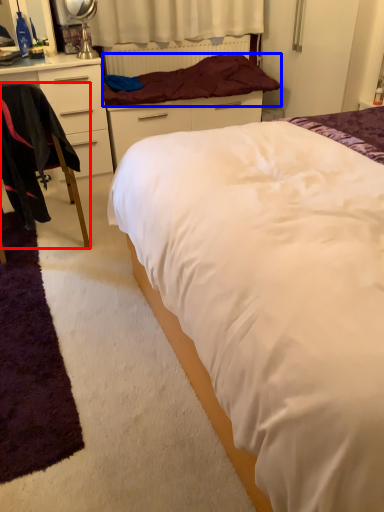
Question: Which object is further to the camera taking this photo, chair (highlighted by a red box) or blanket (highlighted by a blue box)?

Choices:
 (A) chair
 (B) blanket

Answer: (B)